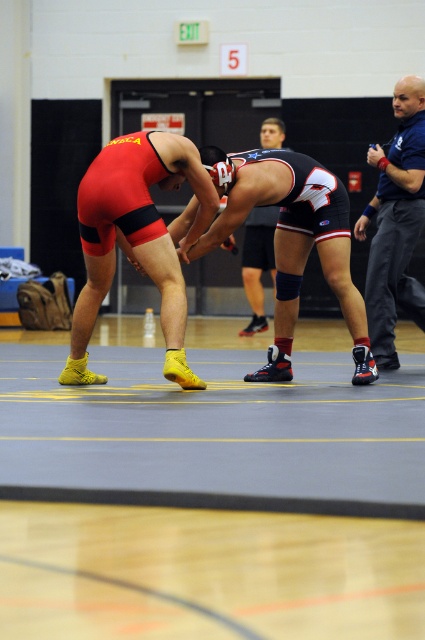
You are a photographer trying to capture the wrestling singlet at center in the gym. Where should you position your camera to focus on the shiny black wrestling singlet at center?

You should position your camera at point (291, 241) to focus on the shiny black wrestling singlet at center.

From the picture: You are a photographer trying to capture the wrestlers in the gym. You notice the shiny black wrestling singlet at center and the shiny black shorts at center. Which object should you focus on if you want to photograph the taller one?

The shiny black wrestling singlet at center is much taller than the shiny black shorts at center, so you should focus on the shiny black wrestling singlet at center.

You are standing in the gymnasium and want to grab the water bottle on the floor near the wrestler in red singlet with black accents and yellow shoes. The water bottle is located at point (336, 184). If you can reach up to 10 meters, will you be able to reach it?

The distance between you and the point (336, 184) is 9.01 meters, which is within your reach of 10 meters. Therefore, you can reach the water bottle at point (336, 184).